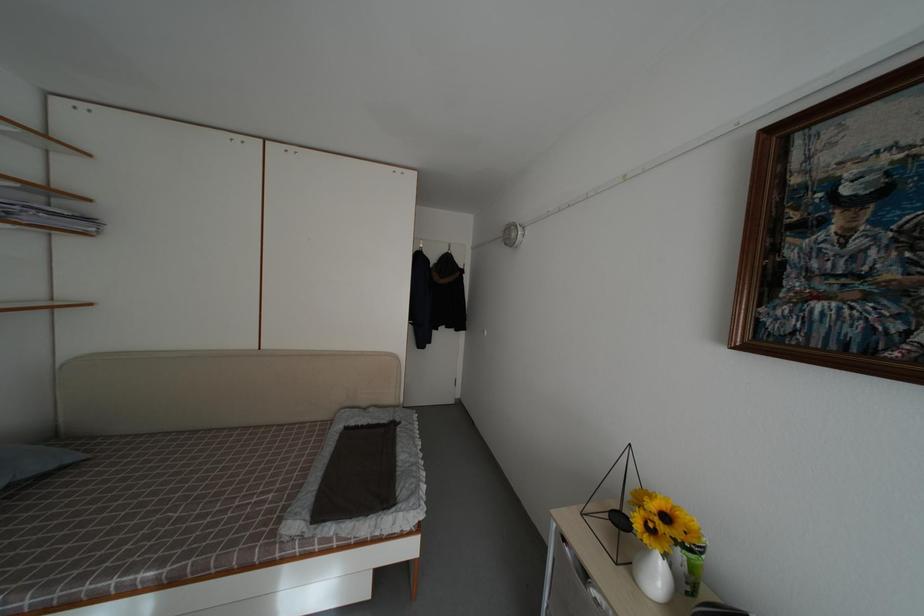
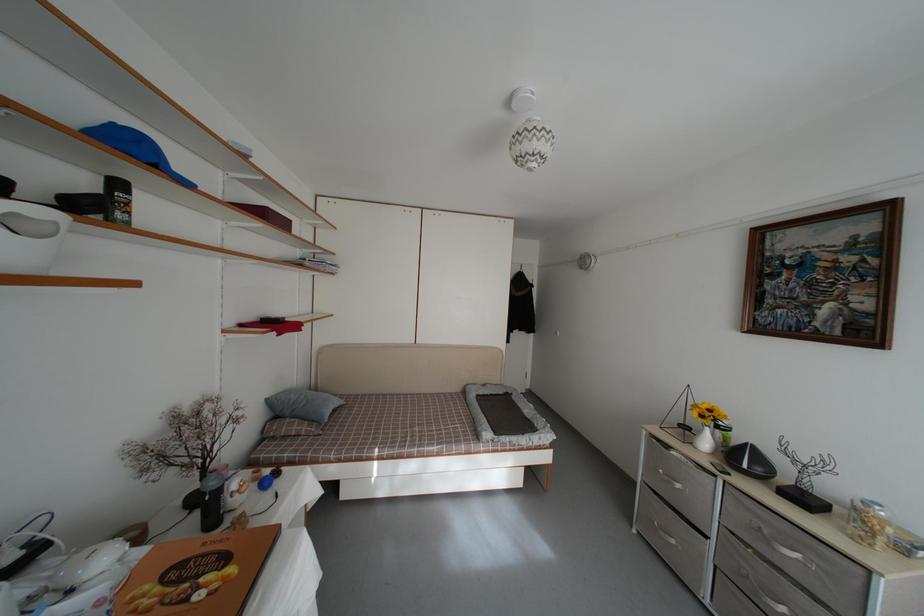
What movement of the cameraman would produce the second image?

The movement direction of the cameraman is left, backward.